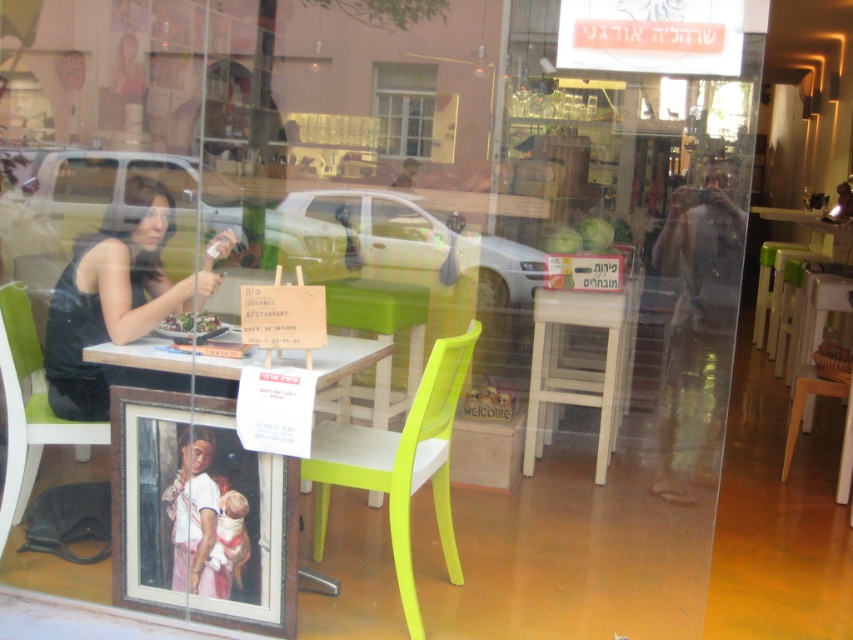
Does black matte dress at left have a greater width compared to white wood table at center?

Indeed, black matte dress at left has a greater width compared to white wood table at center.

Is black matte dress at left thinner than white wood table at center?

No.

Where is `black matte dress at left`? Image resolution: width=853 pixels, height=640 pixels. black matte dress at left is located at coordinates (115, 301).

Identify the location of black matte dress at left. (115, 301).

Can you confirm if white wood table at center is bigger than white glossy table at center?

Yes, white wood table at center is bigger than white glossy table at center.

Can you confirm if white wood table at center is positioned below white glossy table at center?

Indeed, white wood table at center is positioned under white glossy table at center.

Does point (607, 314) come in front of point (335, 339)?

No, (607, 314) is further to viewer.

This screenshot has width=853, height=640. Find the location of `white wood table at center`. white wood table at center is located at coordinates (579, 365).

Is metallic silver phone at right below green plastic chair at lower left?

Actually, metallic silver phone at right is above green plastic chair at lower left.

Does point (701, 316) come in front of point (42, 428)?

No, it is behind (42, 428).

You are a GUI agent. You are given a task and a screenshot of the screen. Output one action in this format:
    pyautogui.click(x=<x>, y=<y>)
    Task: Click on the metallic silver phone at right
    
    Given the screenshot: What is the action you would take?
    pyautogui.click(x=698, y=326)